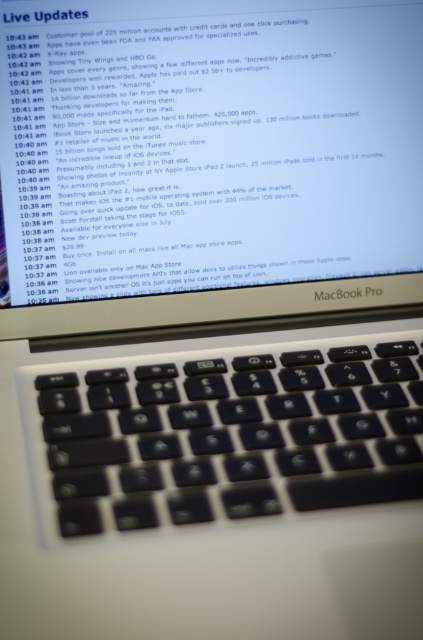
Does matte black macbook pro at center appear under black matte keyboard at center?

No, matte black macbook pro at center is not below black matte keyboard at center.

Who is lower down, matte black macbook pro at center or black matte keyboard at center?

Positioned lower is black matte keyboard at center.

You are a GUI agent. You are given a task and a screenshot of the screen. Output one action in this format:
    pyautogui.click(x=<x>, y=<y>)
    Task: Click on the matte black macbook pro at center
    
    Given the screenshot: What is the action you would take?
    pyautogui.click(x=208, y=144)

Identify the location of matte black macbook pro at center. (208, 144).